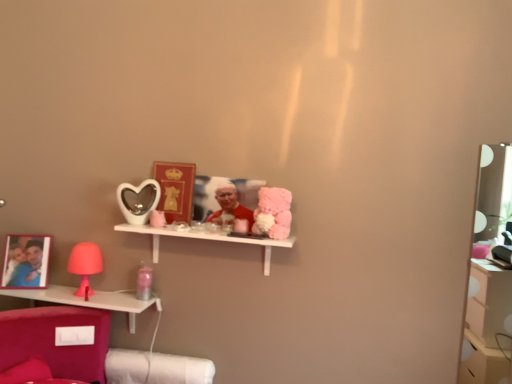
Describe the element at coordinates (85, 266) in the screenshot. This screenshot has width=512, height=384. I see `matte pink lamp at left` at that location.

Find the location of `matte white heart-shaped mirror at center`. matte white heart-shaped mirror at center is located at coordinates click(x=138, y=200).

Find the location of `fluffy pink plush at center`. fluffy pink plush at center is located at coordinates (273, 213).

At what (x,y) coordinates should I click in order to perform the action: click on pink plastic lamp at lower left, which is counted as the 2th shelf, starting from the right. Please return your answer as a coordinate pair (x, y). Looking at the image, I should click on (89, 300).

Image resolution: width=512 pixels, height=384 pixels. Describe the element at coordinates (89, 300) in the screenshot. I see `pink plastic lamp at lower left, marked as the 2th shelf in a top-to-bottom arrangement` at that location.

This screenshot has width=512, height=384. Find the location of `smooth red fabric at center`. smooth red fabric at center is located at coordinates (230, 206).

This screenshot has width=512, height=384. What are the coordinates of `matte gold picture frame at center` in the screenshot? It's located at (175, 189).

Is fluffy pink plush at center positioned far away from matte white heart-shaped mirror at center?

They are positioned close to each other.

Is fluffy pink plush at center situated inside matte white heart-shaped mirror at center or outside?

fluffy pink plush at center cannot be found inside matte white heart-shaped mirror at center.

From the image's perspective, which one is positioned lower, fluffy pink plush at center or matte white heart-shaped mirror at center?

fluffy pink plush at center is shown below in the image.

From the picture: Measure the distance between fluffy pink plush at center and matte white heart-shaped mirror at center.

fluffy pink plush at center and matte white heart-shaped mirror at center are 21.54 inches apart.

Is smooth red fabric at center in front of or behind pink plastic lamp at lower left, marked as the 2th shelf in a top-to-bottom arrangement, in the image?

In the image, smooth red fabric at center appears behind pink plastic lamp at lower left, marked as the 2th shelf in a top-to-bottom arrangement.

Can we say smooth red fabric at center lies outside pink plastic lamp at lower left, the 1th shelf in the bottom-to-top sequence?

Indeed, smooth red fabric at center is completely outside pink plastic lamp at lower left, the 1th shelf in the bottom-to-top sequence.

In terms of height, does smooth red fabric at center look taller or shorter compared to pink plastic lamp at lower left, the 1th shelf in the bottom-to-top sequence?

Clearly, smooth red fabric at center is taller compared to pink plastic lamp at lower left, the 1th shelf in the bottom-to-top sequence.

Is smooth red fabric at center oriented towards pink plastic lamp at lower left, arranged as the first shelf when viewed from the left?

No, smooth red fabric at center is not aimed at pink plastic lamp at lower left, arranged as the first shelf when viewed from the left.

In order to click on shelf that is behind the white glossy shelf at center, which is the second shelf in left-to-right order in this screenshot , I will do `click(89, 300)`.

Considering the sizes of pink plastic lamp at lower left, the 1th shelf in the bottom-to-top sequence, and white glossy shelf at center, which is the second shelf in left-to-right order, in the image, is pink plastic lamp at lower left, the 1th shelf in the bottom-to-top sequence, taller or shorter than white glossy shelf at center, which is the second shelf in left-to-right order,?

pink plastic lamp at lower left, the 1th shelf in the bottom-to-top sequence, is shorter than white glossy shelf at center, which is the second shelf in left-to-right order.

Is pink plastic lamp at lower left, arranged as the first shelf when viewed from the left, oriented away from white glossy shelf at center, which appears as the first shelf when viewed from the top?

No, pink plastic lamp at lower left, arranged as the first shelf when viewed from the left, is not facing away from white glossy shelf at center, which appears as the first shelf when viewed from the top.

From a real-world perspective, is pink plastic lamp at lower left, which is counted as the 2th shelf, starting from the right, positioned above or below white glossy shelf at center, which appears as the first shelf when viewed from the top?

In terms of real-world spatial position, pink plastic lamp at lower left, which is counted as the 2th shelf, starting from the right, is below white glossy shelf at center, which appears as the first shelf when viewed from the top.

From the image's perspective, who appears lower, white glossy shelf at center, which appears as the first shelf when viewed from the top, or matte white heart-shaped mirror at center?

white glossy shelf at center, which appears as the first shelf when viewed from the top, appears lower in the image.

Considering the sizes of objects white glossy shelf at center, which is the second shelf in left-to-right order, and matte white heart-shaped mirror at center in the image provided, who is smaller, white glossy shelf at center, which is the second shelf in left-to-right order, or matte white heart-shaped mirror at center?

matte white heart-shaped mirror at center.

Between white glossy shelf at center, which is the second shelf in left-to-right order, and matte white heart-shaped mirror at center, which one has more height?

Standing taller between the two is matte white heart-shaped mirror at center.

Which object is closer to the camera, white glossy shelf at center, marked as the 2th shelf in a bottom-to-top arrangement, or matte white heart-shaped mirror at center?

white glossy shelf at center, marked as the 2th shelf in a bottom-to-top arrangement, is more forward.

From the image's perspective, is smooth red fabric at center above or below fluffy pink plush at center?

smooth red fabric at center is situated higher than fluffy pink plush at center in the image.

Is smooth red fabric at center thinner than fluffy pink plush at center?

Yes.

Is smooth red fabric at center located outside fluffy pink plush at center?

Yes, smooth red fabric at center is outside of fluffy pink plush at center.

Identify the location of toy lying below the smooth red fabric at center (from the image's perspective). This screenshot has width=512, height=384. (273, 213).

From a real-world perspective, who is located higher, matte pink lamp at left or matte white heart-shaped mirror at center?

From a 3D spatial view, matte white heart-shaped mirror at center is above.

Can you confirm if matte pink lamp at left is bigger than matte white heart-shaped mirror at center?

Indeed, matte pink lamp at left has a larger size compared to matte white heart-shaped mirror at center.

Is matte pink lamp at left completely or partially outside of matte white heart-shaped mirror at center?

Indeed, matte pink lamp at left is completely outside matte white heart-shaped mirror at center.

Would you consider pink plastic lamp at lower left, marked as the 2th shelf in a top-to-bottom arrangement, to be distant from matte pink lamp at left?

No, pink plastic lamp at lower left, marked as the 2th shelf in a top-to-bottom arrangement, is in close proximity to matte pink lamp at left.

Is pink plastic lamp at lower left, arranged as the first shelf when viewed from the left, positioned in front of matte pink lamp at left?

Yes, it is in front of matte pink lamp at left.

Is pink plastic lamp at lower left, marked as the 2th shelf in a top-to-bottom arrangement, facing away from matte pink lamp at left?

No, matte pink lamp at left is not at the back of pink plastic lamp at lower left, marked as the 2th shelf in a top-to-bottom arrangement.

Identify the location of mirror above the fluffy pink plush at center (from a real-world perspective). (138, 200).

Image resolution: width=512 pixels, height=384 pixels. In order to click on the 1st shelf in front of the smooth red fabric at center, counting from the anchor's position in this screenshot , I will do `click(89, 300)`.

Considering their positions, is fluffy pink plush at center positioned closer to white glossy shelf at center, which appears as the first shelf when viewed from the top, than smooth red fabric at center?

Based on the image, smooth red fabric at center appears to be nearer to white glossy shelf at center, which appears as the first shelf when viewed from the top.

Estimate the real-world distances between objects in this image. Which object is closer to matte white heart-shaped mirror at center, pink plastic lamp at lower left, marked as the 2th shelf in a top-to-bottom arrangement, or fluffy pink plush at center?

pink plastic lamp at lower left, marked as the 2th shelf in a top-to-bottom arrangement, is positioned closer to the anchor matte white heart-shaped mirror at center.

Based on their spatial positions, is white glossy shelf at center, which is the second shelf in left-to-right order, or matte gold picture frame at center further from smooth red fabric at center?

matte gold picture frame at center is positioned further to the anchor smooth red fabric at center.

Estimate the real-world distances between objects in this image. Which object is closer to white glossy shelf at center, marked as the 2th shelf in a bottom-to-top arrangement, matte gold picture frame at center or pink plastic lamp at lower left, arranged as the first shelf when viewed from the left?

matte gold picture frame at center lies closer to white glossy shelf at center, marked as the 2th shelf in a bottom-to-top arrangement, than the other object.

When comparing their distances from matte pink lamp at left, does fluffy pink plush at center or matte gold picture frame at center seem closer?

matte gold picture frame at center is positioned closer to the anchor matte pink lamp at left.

Looking at the image, which one is located further to matte gold picture frame at center, pink plastic lamp at lower left, the 1th shelf in the bottom-to-top sequence, or fluffy pink plush at center?

pink plastic lamp at lower left, the 1th shelf in the bottom-to-top sequence, is positioned further to the anchor matte gold picture frame at center.

When comparing their distances from matte gold picture frame at center, does smooth red fabric at center or fluffy pink plush at center seem closer?

smooth red fabric at center.

Looking at the image, which one is located closer to matte pink lamp at left, smooth red fabric at center or matte gold picture frame at center?

matte gold picture frame at center.

Find the location of a particular element. The height and width of the screenshot is (384, 512). mirror located between pink plastic lamp at lower left, marked as the 2th shelf in a top-to-bottom arrangement, and white glossy shelf at center, which appears as the first shelf when viewed from the top, in the left-right direction is located at coordinates point(138,200).

Locate an element on the screen. The height and width of the screenshot is (384, 512). table lamp that lies between matte white heart-shaped mirror at center and pink plastic lamp at lower left, marked as the 2th shelf in a top-to-bottom arrangement, from top to bottom is located at coordinates (85, 266).

Identify the location of table lamp between pink plastic lamp at lower left, marked as the 2th shelf in a top-to-bottom arrangement, and white glossy shelf at center, marked as the 2th shelf in a bottom-to-top arrangement, from left to right. (85, 266).

Identify the location of picture frame located between matte pink lamp at left and smooth red fabric at center in the left-right direction. (175, 189).